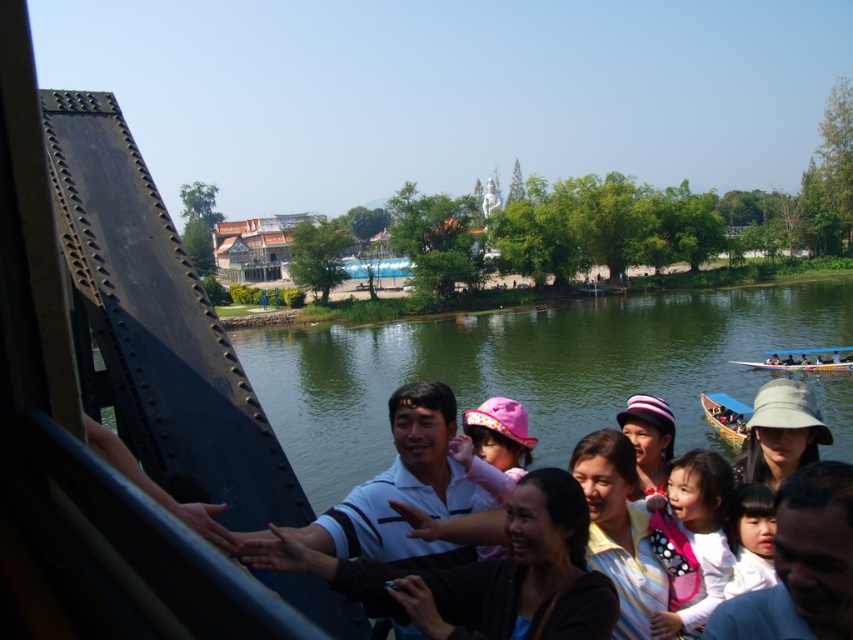
Between light pink fabric at center and white polka dot dress at center, which one has less height?

light pink fabric at center

Can you confirm if light pink fabric at center is wider than white polka dot dress at center?

Incorrect, light pink fabric at center's width does not surpass white polka dot dress at center's.

What do you see at coordinates (801, 564) in the screenshot? I see `light pink fabric at center` at bounding box center [801, 564].

The width and height of the screenshot is (853, 640). I want to click on light pink fabric at center, so (x=801, y=564).

Can you confirm if matte white shirt at center is wider than smooth white shirt at center?

Indeed, matte white shirt at center has a greater width compared to smooth white shirt at center.

Which of these two, matte white shirt at center or smooth white shirt at center, stands shorter?

With less height is smooth white shirt at center.

Is point (445, 572) more distant than point (734, 522)?

No, (445, 572) is in front of (734, 522).

Identify the location of matte white shirt at center. (480, 573).

Can you confirm if white polka dot dress at center is taller than striped fabric hat at center?

Yes.

Can you confirm if white polka dot dress at center is shorter than striped fabric hat at center?

Incorrect, white polka dot dress at center's height does not fall short of striped fabric hat at center's.

Which is behind, point (720, 488) or point (664, 426)?

Positioned behind is point (664, 426).

The width and height of the screenshot is (853, 640). I want to click on white polka dot dress at center, so click(x=698, y=534).